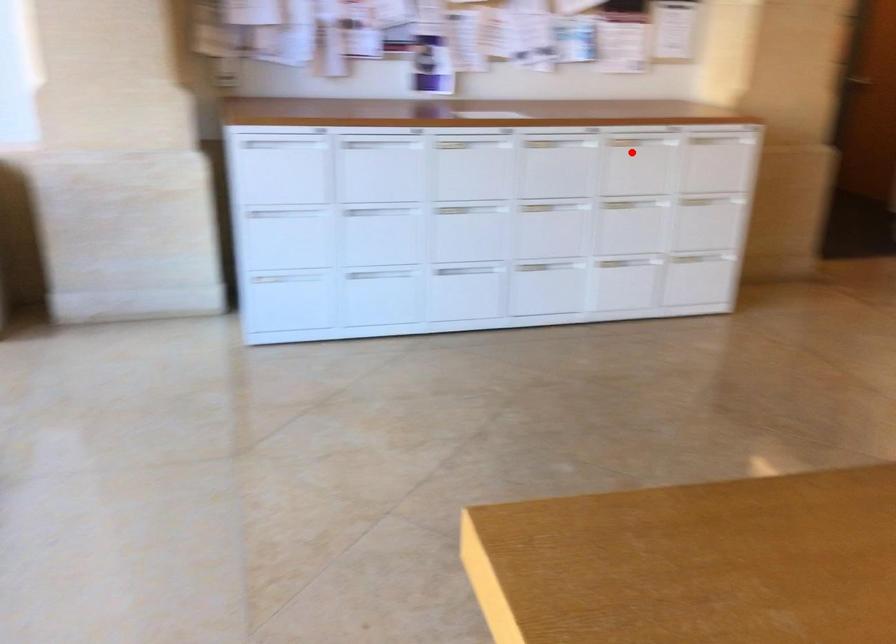
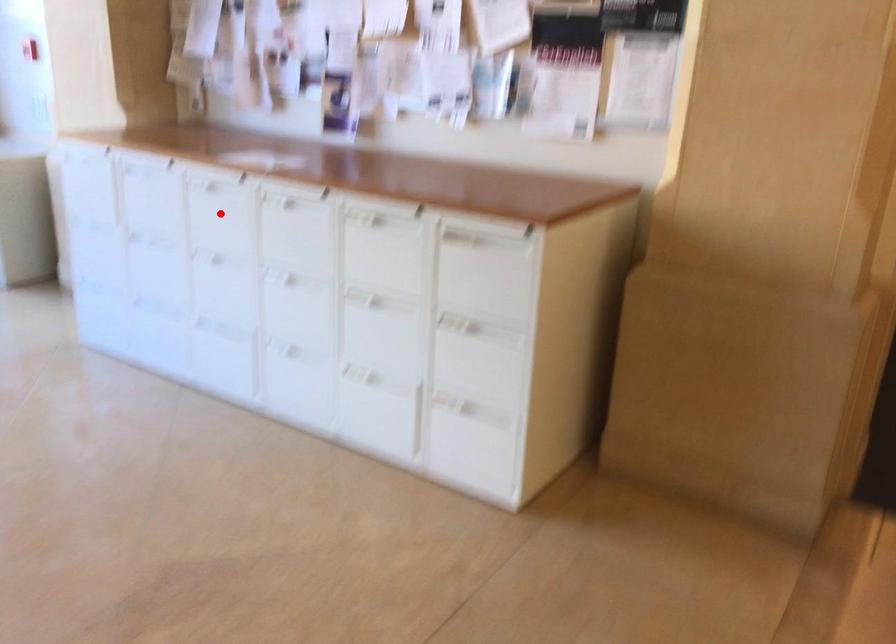
I am providing you with two images of the same scene from different viewpoints. A red point is marked on the first image and another point is marked on the second image. Is the marked point in image1 the same physical position as the marked point in image2?

No